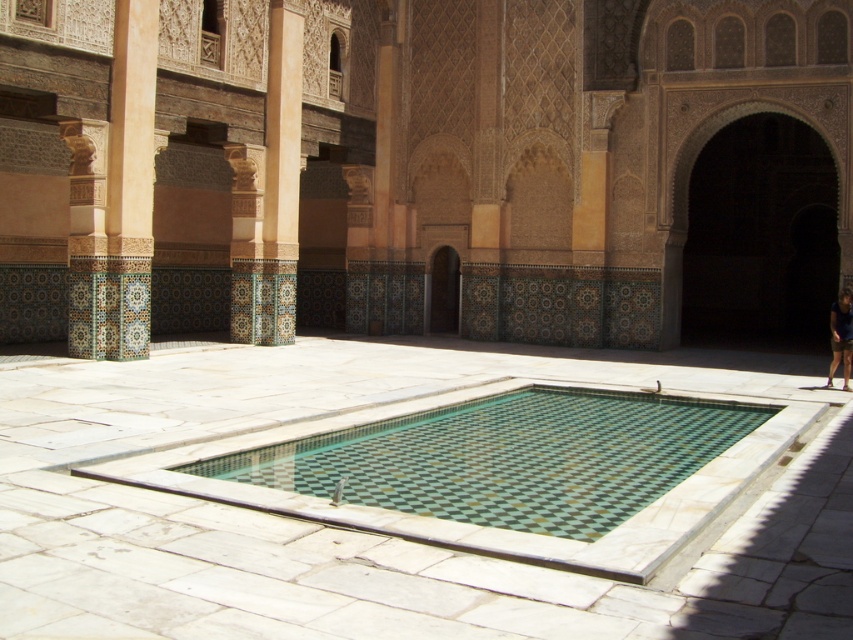
Based on the photo, you are standing in the courtyard and want to take a photo of the green mosaic pool at center without the dark blue fabric at lower right appearing in the shot. Which direction should you move to ensure the fabric is out of frame?

Move towards the green mosaic pool at center away from the dark blue fabric at lower right since the pool is in front of the fabric. By moving closer to the pool, the fabric will be obscured behind you or out of the frame.

You are standing in the courtyard and want to find shade. The green mosaic pool at center and the dark blue fabric at lower right are in your view. Which object provides shade?

The dark blue fabric at lower right provides shade because it is positioned above the green mosaic pool at center, casting a shadow over it.

You are standing in the courtyard and want to locate the green mosaic tile swimming pool at center. According to the coordinates provided, where exactly is it positioned?

The green mosaic tile swimming pool at center is located at point coordinates of 0.716 on the x axis and 0.597 on the y axis.